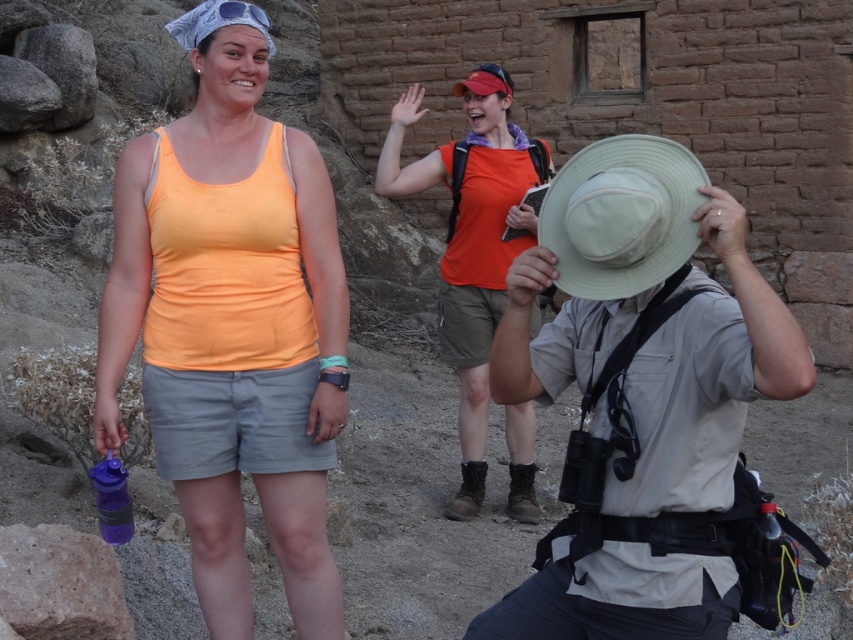
You are a photographer trying to capture a closeup of a rare desert flower located between the khaki fabric hat at center and the light beige straw hat at center. Which hat should you focus on to ensure the flower is in the frame?

The khaki fabric hat at center has a larger width than the light beige straw hat at center, so focusing on the khaki fabric hat at center would provide a wider field of view to include the flower between them.

You are a photographer trying to capture a group photo of the two people in the middle ground. You want to ensure both the orange matte tank top at center and the light beige straw hat at center are clearly visible. Which object should you position closer to the left side of the frame to achieve this?

The orange matte tank top at center is already positioned to the left of the light beige straw hat at center, so to ensure both are visible, you should keep the orange matte tank top at center on the left side of the frame and the light beige straw hat at center on the right side.